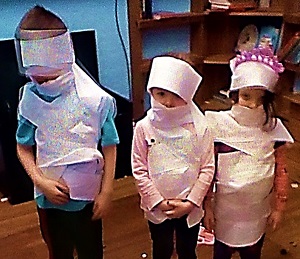
Find the location of `cord`. cord is located at coordinates (124, 48).